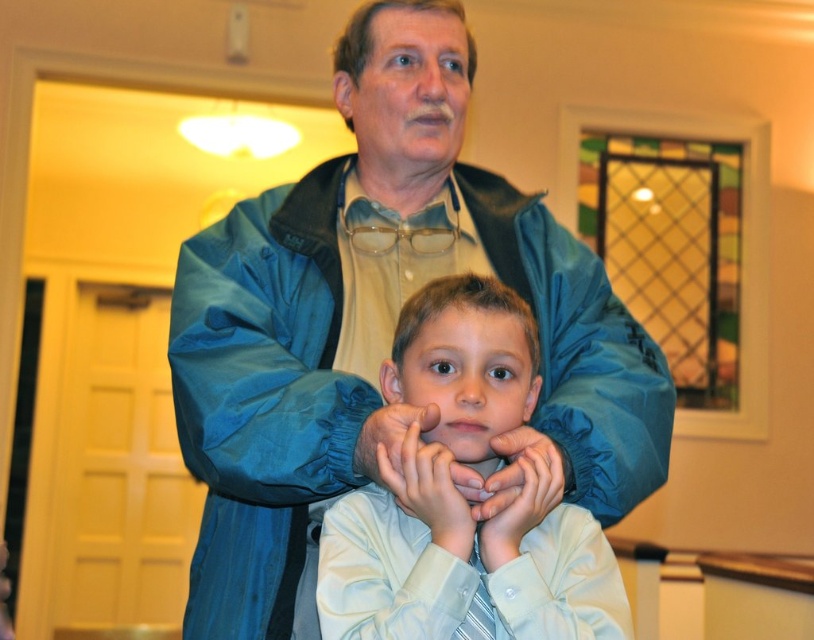
You are a tailor measuring two blue items in the image. The first item is the blue nylon jacket at center, and the second is the blue fabric hand at center. Which item requires more fabric for alterations?

The blue nylon jacket at center requires more fabric for alterations since it has a larger size compared to the blue fabric hand at center.

Looking at this image, you are a photographer setting up for a family portrait. You notice the blue nylon jacket at center and the blue fabric hand at center in the scene. Which object is positioned higher in the image?

The blue nylon jacket at center is above the blue fabric hand at center, so the blue nylon jacket at center is positioned higher in the image.